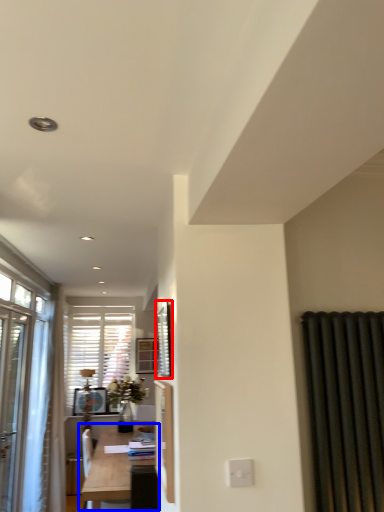
Question: Which of the following is the farthest to the observer, window screen (highlighted by a red box) or table (highlighted by a blue box)?

Choices:
 (A) window screen
 (B) table

Answer: (B)